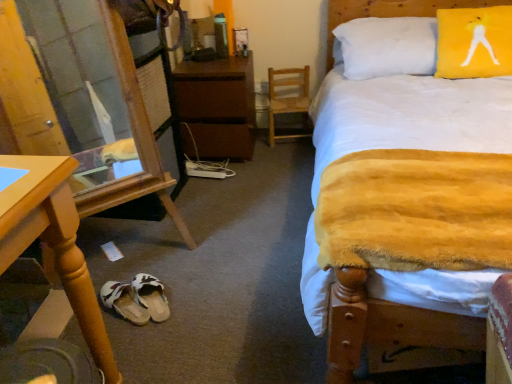
The width and height of the screenshot is (512, 384). Find the location of `free spot behind transparent glass door at lower left`. free spot behind transparent glass door at lower left is located at coordinates (144, 223).